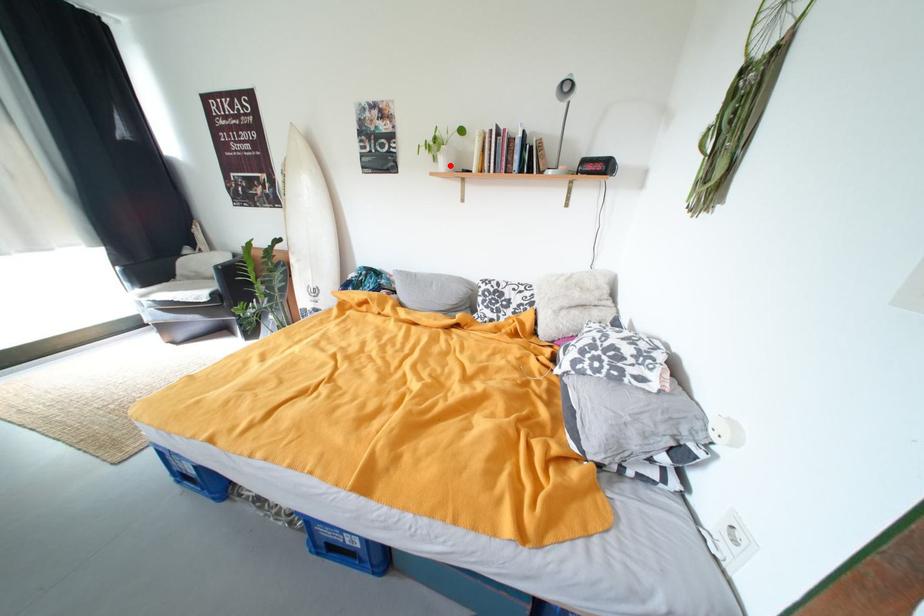
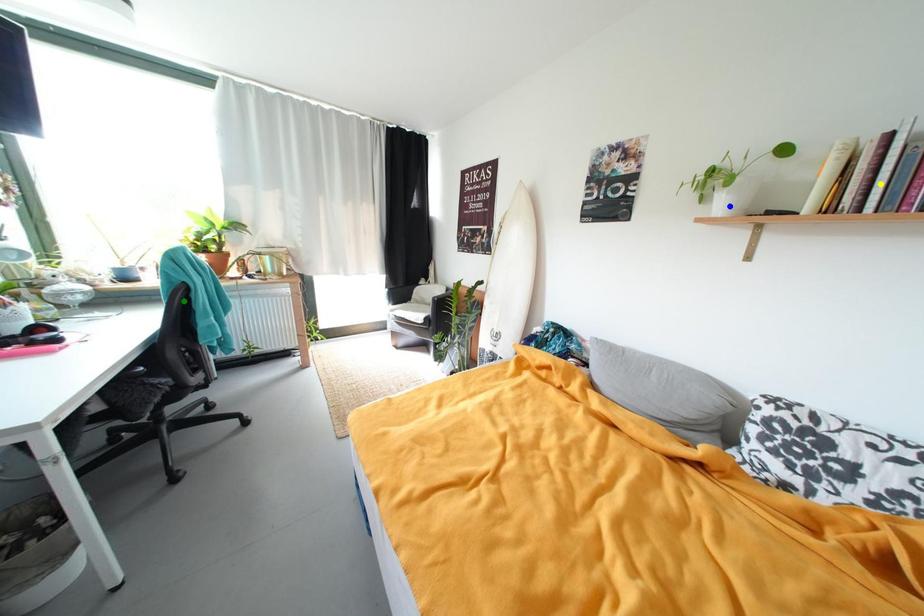
Question: I am providing you with two images of the same scene from different viewpoints. A red point is marked on the first image. You are given multiple points on the second image. In image 2, which mark is for the same physical point as the one in image 1?

Choices:
 (A) yellow point
 (B) blue point
 (C) green point

Answer: (B)